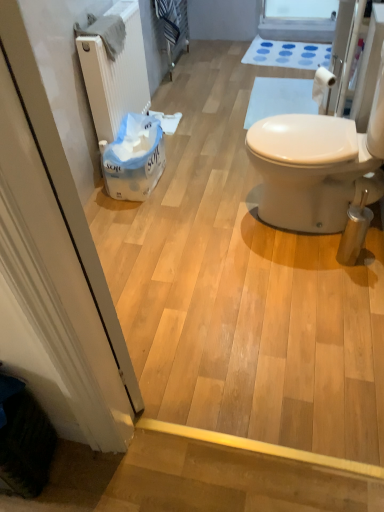
Question: Is there a large distance between white rubber bath mat at upper center and transparent plastic window screen at upper center?

Choices:
 (A) no
 (B) yes

Answer: (A)

Question: Is white rubber bath mat at upper center outside transparent plastic window screen at upper center?

Choices:
 (A) yes
 (B) no

Answer: (A)

Question: Considering the relative positions of white rubber bath mat at upper center and transparent plastic window screen at upper center in the image provided, is white rubber bath mat at upper center in front of transparent plastic window screen at upper center?

Choices:
 (A) yes
 (B) no

Answer: (A)

Question: Does white rubber bath mat at upper center have a lesser height compared to transparent plastic window screen at upper center?

Choices:
 (A) no
 (B) yes

Answer: (B)

Question: Is white rubber bath mat at upper center taller than transparent plastic window screen at upper center?

Choices:
 (A) no
 (B) yes

Answer: (A)

Question: Considering the positions of transparent plastic window screen at upper center and white soft tissue at center, which is the second toilet paper in front-to-back order, in the image, is transparent plastic window screen at upper center taller or shorter than white soft tissue at center, which is the second toilet paper in front-to-back order,?

Choices:
 (A) short
 (B) tall

Answer: (B)

Question: Considering the relative positions of transparent plastic window screen at upper center and white soft tissue at center, the 2th toilet paper when ordered from right to left, in the image provided, is transparent plastic window screen at upper center to the left or to the right of white soft tissue at center, the 2th toilet paper when ordered from right to left,?

Choices:
 (A) left
 (B) right

Answer: (B)

Question: From the image's perspective, is transparent plastic window screen at upper center above or below white soft tissue at center, arranged as the first toilet paper when viewed from the left?

Choices:
 (A) above
 (B) below

Answer: (A)

Question: Is transparent plastic window screen at upper center situated inside white soft tissue at center, arranged as the first toilet paper when viewed from the left, or outside?

Choices:
 (A) inside
 (B) outside

Answer: (B)

Question: Is white soft tissue at center, arranged as the first toilet paper when viewed from the left, bigger or smaller than transparent plastic window screen at upper center?

Choices:
 (A) small
 (B) big

Answer: (A)

Question: From the image's perspective, is white soft tissue at center, arranged as the first toilet paper when viewed from the left, above or below transparent plastic window screen at upper center?

Choices:
 (A) above
 (B) below

Answer: (B)

Question: From a real-world perspective, is white soft tissue at center, which is the second toilet paper in front-to-back order, positioned above or below transparent plastic window screen at upper center?

Choices:
 (A) below
 (B) above

Answer: (A)

Question: Looking at their shapes, would you say white soft tissue at center, which is the second toilet paper in front-to-back order, is wider or thinner than transparent plastic window screen at upper center?

Choices:
 (A) thin
 (B) wide

Answer: (A)

Question: Considering the positions of white rubber bath mat at upper center and white soft tissue at center, placed as the first toilet paper when sorted from back to front, in the image, is white rubber bath mat at upper center bigger or smaller than white soft tissue at center, placed as the first toilet paper when sorted from back to front,?

Choices:
 (A) small
 (B) big

Answer: (B)

Question: From a real-world perspective, is white rubber bath mat at upper center physically located above or below white soft tissue at center, which is the second toilet paper in front-to-back order?

Choices:
 (A) below
 (B) above

Answer: (A)